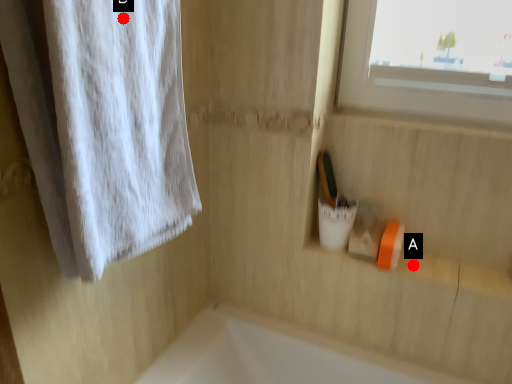
Question: Two points are circled on the image, labeled by A and B beside each circle. Which point appears closest to the camera in this image?

Choices:
 (A) A is closer
 (B) B is closer

Answer: (B)